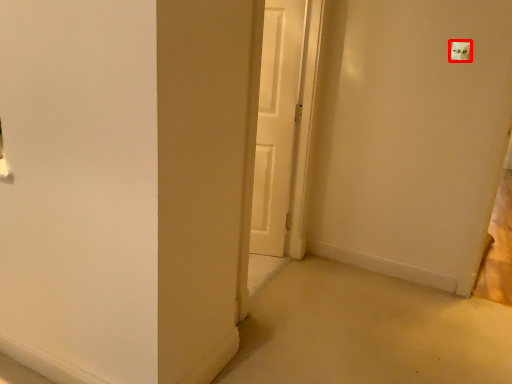
Question: From the image, what is the correct spatial relationship of light switch (annotated by the red box) in relation to door?

Choices:
 (A) right
 (B) left

Answer: (A)